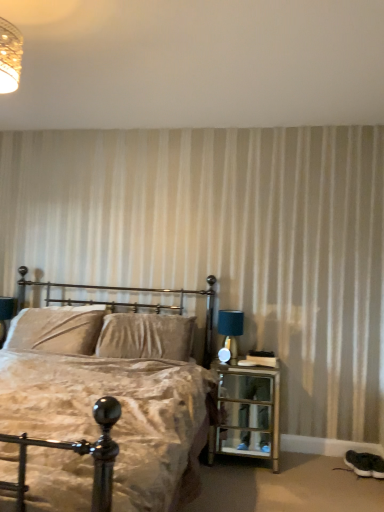
This screenshot has width=384, height=512. I want to click on vacant space situated above clear glass nightstand at right (from a real-world perspective), so click(x=251, y=360).